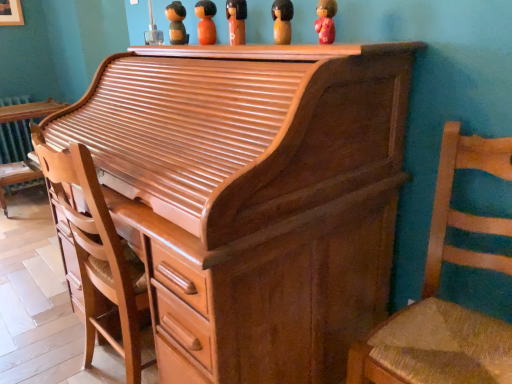
Question: In the image, is wooden figurine at upper center, placed as the fifth toy when sorted from front to back, on the left side or the right side of wooden woven seat at right, which is counted as the 1th chair, starting from the right?

Choices:
 (A) right
 (B) left

Answer: (B)

Question: Considering the positions of wooden figurine at upper center, acting as the first toy starting from the left, and wooden woven seat at right, which is counted as the 1th chair, starting from the right, in the image, is wooden figurine at upper center, acting as the first toy starting from the left, wider or thinner than wooden woven seat at right, which is counted as the 1th chair, starting from the right,?

Choices:
 (A) thin
 (B) wide

Answer: (A)

Question: Estimate the real-world distances between objects in this image. Which object is closer to the matte orange doll at upper center, which is the third toy from left to right?

Choices:
 (A) shiny brown wood desk at left
 (B) shiny brown piano at center
 (C) orange matte wooden doll at center, placed as the 4th toy when sorted from right to left
 (D) light brown wood chair at left, the first chair in the left-to-right sequence
 (E) matte pink figurine at upper center, arranged as the first toy when viewed from the right

Answer: (C)

Question: Which of these objects is positioned farthest from the matte pink figurine at upper center, arranged as the first toy when viewed from the right?

Choices:
 (A) shiny brown wood desk at left
 (B) matte orange doll at upper center, which is the third toy from left to right
 (C) wooden woven seat at right, which is counted as the 1th chair, starting from the right
 (D) wooden figurine at upper center, marked as the 2th toy in a right-to-left arrangement
 (E) shiny brown piano at center

Answer: (A)